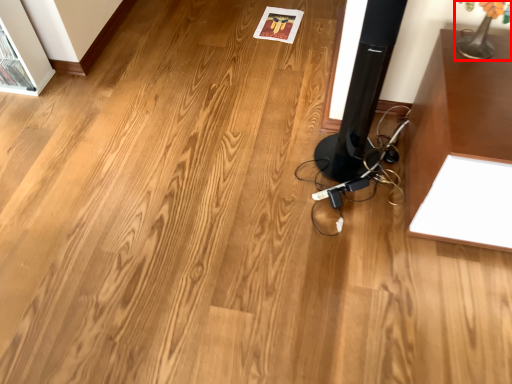
Question: From the image's perspective, where is table lamp (annotated by the red box) located in relation to speaker in the image?

Choices:
 (A) above
 (B) below

Answer: (A)